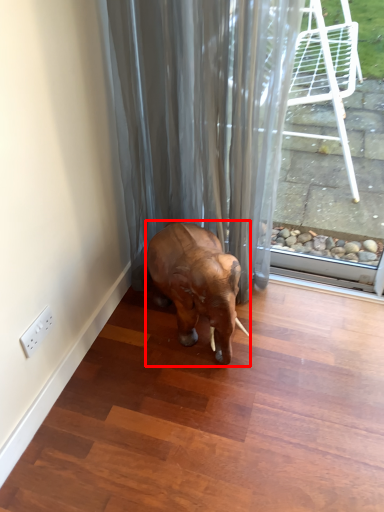
Question: In this image, where is elephant (annotated by the red box) located relative to shower curtain?

Choices:
 (A) right
 (B) left

Answer: (A)